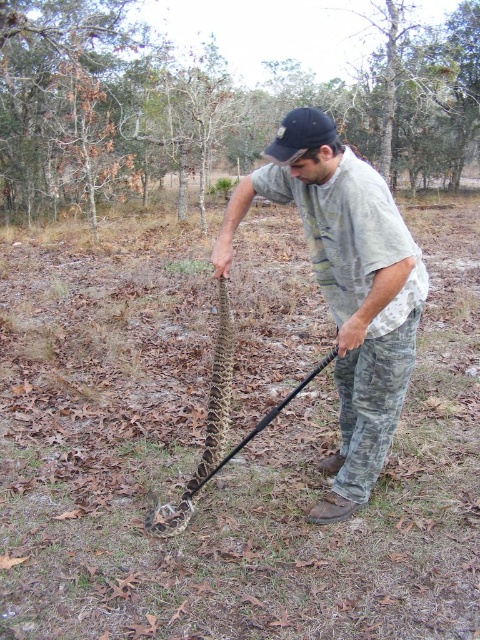
Question: Does camouflage pants at center have a smaller size compared to camouflage-patterned snake at center?

Choices:
 (A) no
 (B) yes

Answer: (A)

Question: Is camouflage pants at center positioned at the back of camouflage-patterned snake at center?

Choices:
 (A) yes
 (B) no

Answer: (B)

Question: Among these objects, which one is farthest from the camera?

Choices:
 (A) camouflage-patterned snake at center
 (B) camouflage pants at center
 (C) black fabric baseball cap at center

Answer: (A)

Question: Which of the following is the farthest from the observer?

Choices:
 (A) camouflage-patterned snake at center
 (B) black fabric baseball cap at center

Answer: (A)

Question: Observing the image, what is the correct spatial positioning of brown textured tree at center in reference to camouflage pants at center?

Choices:
 (A) right
 (B) left

Answer: (B)

Question: Which point is closer to the camera?

Choices:
 (A) camouflage-patterned snake at center
 (B) black fabric baseball cap at center
 (C) brown textured tree at center

Answer: (B)